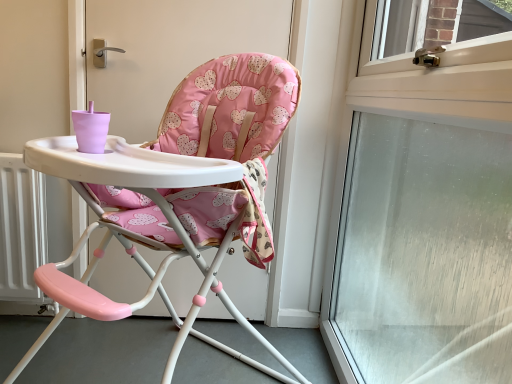
Question: Are pink fabric highchair at center and transparent glass window at upper right far apart?

Choices:
 (A) no
 (B) yes

Answer: (A)

Question: Is pink fabric highchair at center behind transparent glass window at upper right?

Choices:
 (A) yes
 (B) no

Answer: (A)

Question: Is the position of pink fabric highchair at center less distant than that of transparent glass window at upper right?

Choices:
 (A) yes
 (B) no

Answer: (B)

Question: Is pink fabric highchair at center shorter than transparent glass window at upper right?

Choices:
 (A) no
 (B) yes

Answer: (B)

Question: Does pink fabric highchair at center have a larger size compared to transparent glass window at upper right?

Choices:
 (A) yes
 (B) no

Answer: (A)

Question: From the image's perspective, is pink fabric highchair at center above transparent glass window at upper right?

Choices:
 (A) no
 (B) yes

Answer: (A)

Question: Does transparent glass window at upper right lie in front of pink fabric highchair at center?

Choices:
 (A) no
 (B) yes

Answer: (B)

Question: Is transparent glass window at upper right further to camera compared to pink fabric highchair at center?

Choices:
 (A) yes
 (B) no

Answer: (B)

Question: From the image's perspective, is transparent glass window at upper right located beneath pink fabric highchair at center?

Choices:
 (A) yes
 (B) no

Answer: (B)

Question: From the image's perspective, is transparent glass window at upper right on top of pink fabric highchair at center?

Choices:
 (A) no
 (B) yes

Answer: (B)

Question: Does transparent glass window at upper right have a greater width compared to pink fabric highchair at center?

Choices:
 (A) yes
 (B) no

Answer: (B)

Question: Can you confirm if transparent glass window at upper right is positioned to the right of pink fabric highchair at center?

Choices:
 (A) yes
 (B) no

Answer: (A)

Question: From the image's perspective, is transparent glass window at upper right positioned above or below pink fabric highchair at center?

Choices:
 (A) above
 (B) below

Answer: (A)